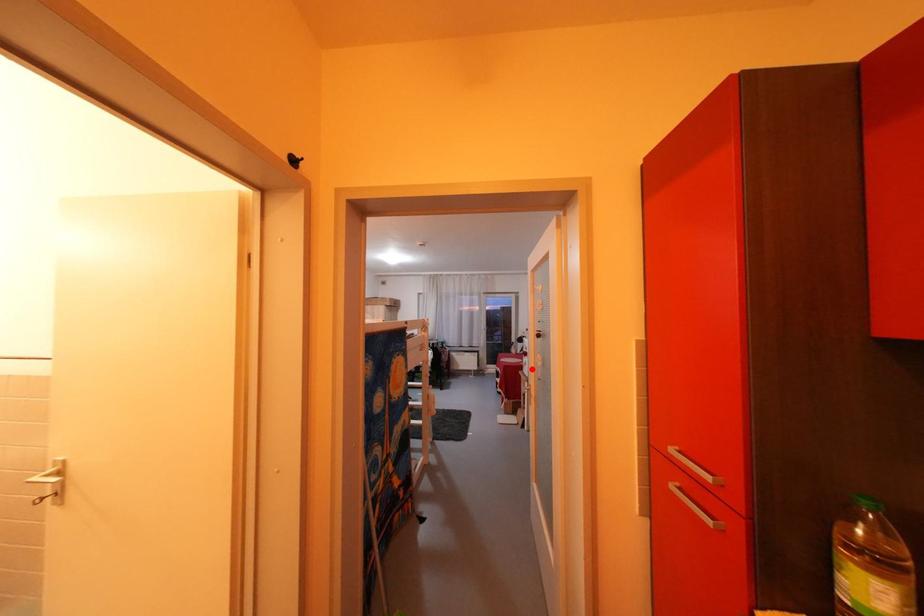
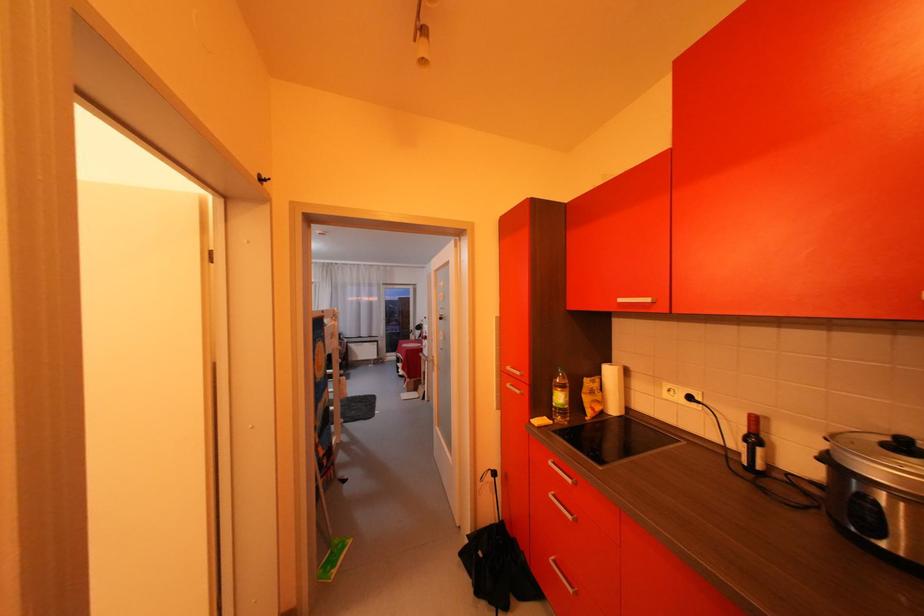
Where in the second image is the point corresponding to the highlighted location from the first image?

(432, 352)